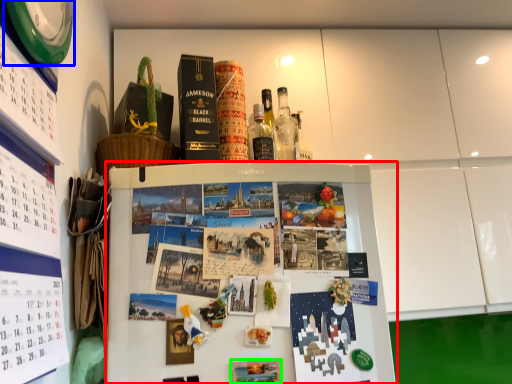
Question: Which object is the farthest from refrigerator (highlighted by a red box)? Choose among these: clock (highlighted by a blue box) or book cover (highlighted by a green box).

Choices:
 (A) clock
 (B) book cover

Answer: (A)